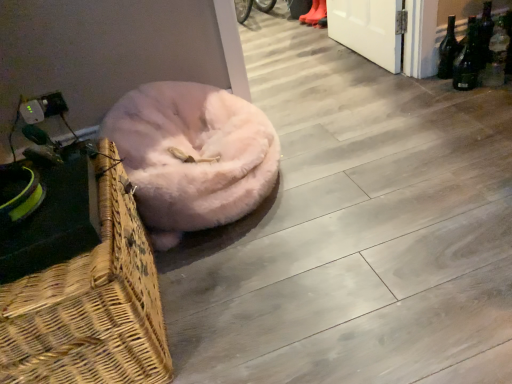
Find the location of a particular element. This screenshot has height=384, width=512. vacant space that is to the left of orange rubber boots at upper center is located at coordinates (288, 24).